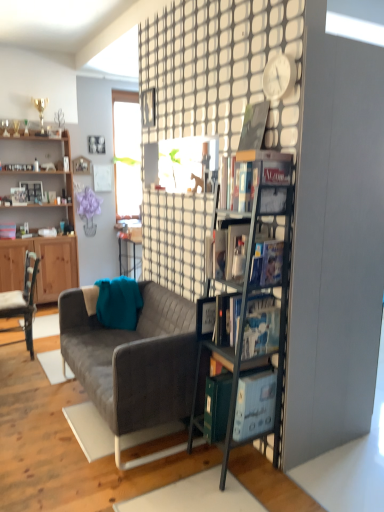
Question: Does matte black book at upper right, which is counted as the second book, starting from the top, have a smaller size compared to hardcover book at upper right, the 1th book when ordered from top to bottom?

Choices:
 (A) yes
 (B) no

Answer: (B)

Question: Is matte black book at upper right, which is counted as the second book, starting from the top, shorter than hardcover book at upper right, the 1th book when ordered from top to bottom?

Choices:
 (A) yes
 (B) no

Answer: (A)

Question: Is matte black book at upper right, which is counted as the second book, starting from the top, positioned beyond the bounds of hardcover book at upper right, which ranks as the fourth book in bottom-to-top order?

Choices:
 (A) no
 (B) yes

Answer: (B)

Question: From the image's perspective, is matte black book at upper right, which is counted as the second book, starting from the top, under hardcover book at upper right, the 1th book when ordered from top to bottom?

Choices:
 (A) yes
 (B) no

Answer: (A)

Question: Considering the relative sizes of matte black book at upper right, the 3th book positioned from the bottom, and hardcover book at upper right, which ranks as the fourth book in bottom-to-top order, in the image provided, is matte black book at upper right, the 3th book positioned from the bottom, wider than hardcover book at upper right, which ranks as the fourth book in bottom-to-top order,?

Choices:
 (A) no
 (B) yes

Answer: (B)

Question: Is hardcover book at upper right, the 1th book when ordered from top to bottom, completely or partially inside matte black book at upper right, the 3th book positioned from the bottom?

Choices:
 (A) yes
 (B) no

Answer: (B)

Question: Can we say white plastic clock at upper center lies outside matte black book at upper right, which is counted as the second book, starting from the top?

Choices:
 (A) no
 (B) yes

Answer: (B)

Question: Is white plastic clock at upper center far away from matte black book at upper right, the 3th book positioned from the bottom?

Choices:
 (A) no
 (B) yes

Answer: (A)

Question: From the image's perspective, is white plastic clock at upper center under matte black book at upper right, which is counted as the second book, starting from the top?

Choices:
 (A) yes
 (B) no

Answer: (B)

Question: From a real-world perspective, is white plastic clock at upper center physically below matte black book at upper right, which is counted as the second book, starting from the top?

Choices:
 (A) no
 (B) yes

Answer: (A)

Question: From the image's perspective, would you say white plastic clock at upper center is positioned over matte black book at upper right, which is counted as the second book, starting from the top?

Choices:
 (A) yes
 (B) no

Answer: (A)

Question: Can you confirm if white plastic clock at upper center is taller than matte black book at upper right, the 3th book positioned from the bottom?

Choices:
 (A) no
 (B) yes

Answer: (A)

Question: Is hardcover book at center, which is counted as the 1th book, starting from the bottom, far from purple fabric plant at upper center?

Choices:
 (A) yes
 (B) no

Answer: (A)